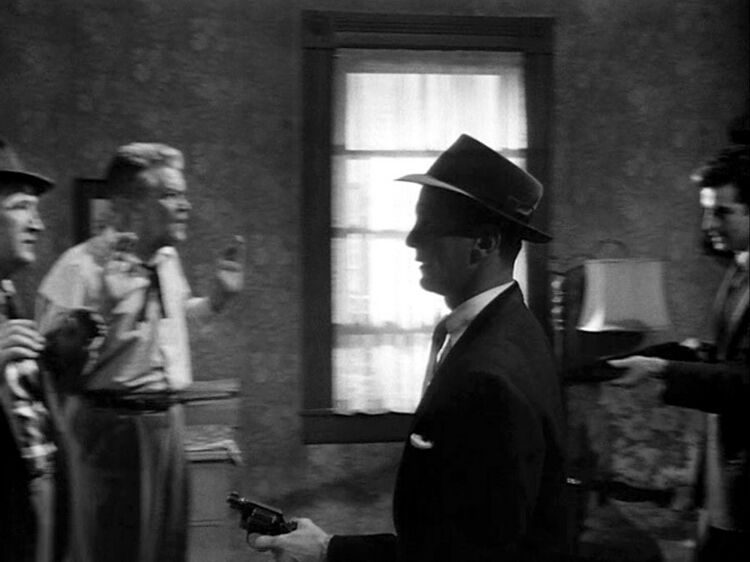
What are the coordinates of `window` in the screenshot? It's located at (404, 316).